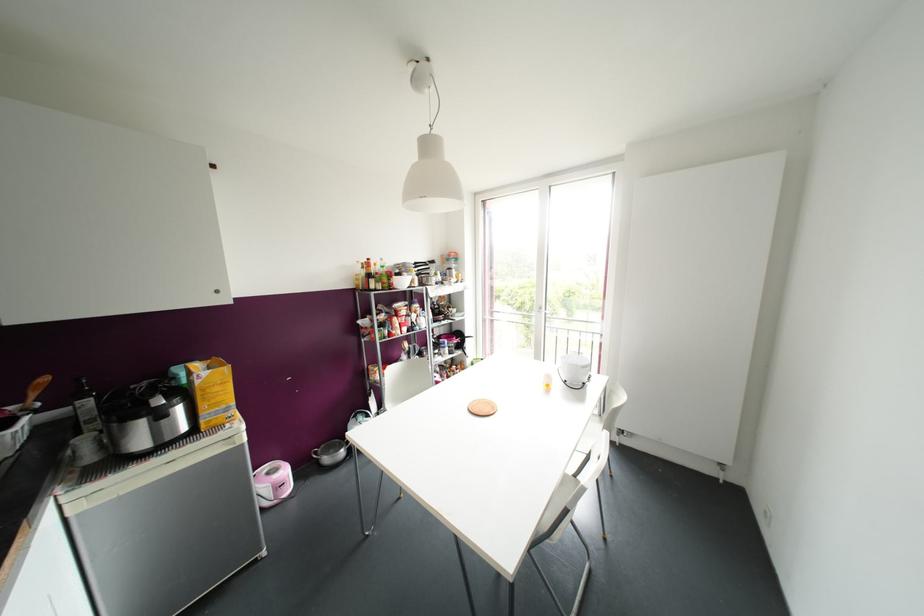
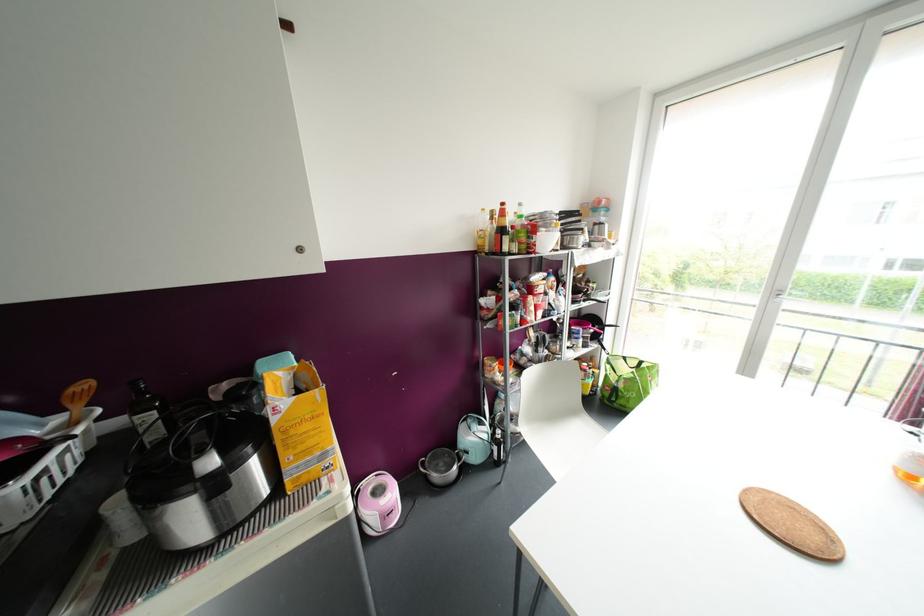
The point at (87,402) is marked in the first image. Where is the corresponding point in the second image?

(150, 416)